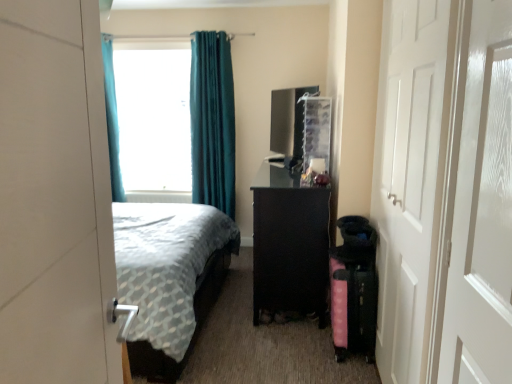
Question: Which direction should I rotate to look at teal velvet curtain at upper center, which is the 2th curtain from left to right?

Choices:
 (A) right
 (B) left

Answer: (B)

Question: Does pink fabric suitcase at lower right touch white glossy door at left, acting as the 2th door starting from the back?

Choices:
 (A) yes
 (B) no

Answer: (B)

Question: From a real-world perspective, is pink fabric suitcase at lower right on top of white glossy door at left, which appears as the first door when viewed from the front?

Choices:
 (A) yes
 (B) no

Answer: (B)

Question: Is pink fabric suitcase at lower right at the left side of white glossy door at left, acting as the 2th door starting from the back?

Choices:
 (A) yes
 (B) no

Answer: (B)

Question: Is pink fabric suitcase at lower right wider than white glossy door at left, the second door in the right-to-left sequence?

Choices:
 (A) no
 (B) yes

Answer: (B)

Question: Considering the relative sizes of pink fabric suitcase at lower right and white glossy door at left, which appears as the 1th door when viewed from the left, in the image provided, is pink fabric suitcase at lower right smaller than white glossy door at left, which appears as the 1th door when viewed from the left,?

Choices:
 (A) no
 (B) yes

Answer: (B)

Question: From the image's perspective, is pink fabric suitcase at lower right on top of white glossy door at left, which appears as the 1th door when viewed from the left?

Choices:
 (A) no
 (B) yes

Answer: (A)

Question: From the image's perspective, is white glossy door at left, the second door in the right-to-left sequence, located above white matte door at right, which ranks as the 1th door in back-to-front order?

Choices:
 (A) no
 (B) yes

Answer: (A)

Question: Is white glossy door at left, the second door in the right-to-left sequence, positioned before white matte door at right, positioned as the second door in left-to-right order?

Choices:
 (A) yes
 (B) no

Answer: (A)

Question: From a real-world perspective, does white glossy door at left, the second door in the right-to-left sequence, sit lower than white matte door at right, which ranks as the 1th door in right-to-left order?

Choices:
 (A) yes
 (B) no

Answer: (B)

Question: Is white glossy door at left, which appears as the first door when viewed from the front, to the right of white matte door at right, the 2th door from the front, from the viewer's perspective?

Choices:
 (A) yes
 (B) no

Answer: (B)

Question: Can you confirm if white glossy door at left, which appears as the 1th door when viewed from the left, is smaller than white matte door at right, the 2th door from the front?

Choices:
 (A) no
 (B) yes

Answer: (B)

Question: Would you say white matte door at right, which ranks as the 1th door in back-to-front order, is part of white glossy door at left, acting as the 2th door starting from the back,'s contents?

Choices:
 (A) no
 (B) yes

Answer: (A)

Question: Is pink fabric suitcase at lower right outside of transparent frosted glass screen door at right?

Choices:
 (A) yes
 (B) no

Answer: (A)